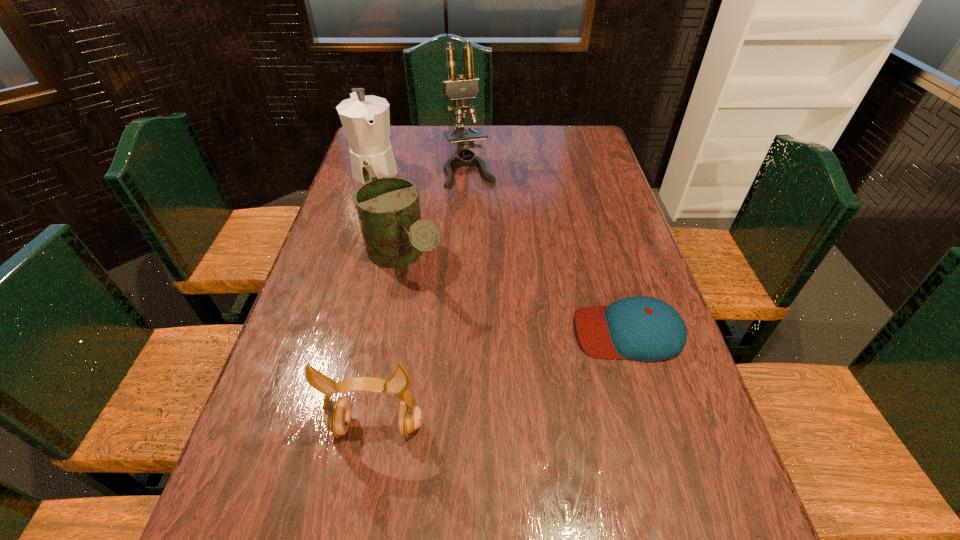
Locate an element on the screen. free area in between the microscope and the coffeepot is located at coordinates (422, 170).

Locate an element on the screen. This screenshot has height=540, width=960. free space between the coffeepot and the tallest object is located at coordinates (422, 170).

The height and width of the screenshot is (540, 960). I want to click on vacant area between the rightmost object and the microscope, so pyautogui.click(x=549, y=251).

Where is `free space between the watering can and the earphone`? The image size is (960, 540). free space between the watering can and the earphone is located at coordinates (391, 342).

You are a GUI agent. You are given a task and a screenshot of the screen. Output one action in this format:
    pyautogui.click(x=<x>, y=<y>)
    Task: Click on the free area in between the nearest object and the tallest object
    The height and width of the screenshot is (540, 960).
    Given the screenshot: What is the action you would take?
    [423, 299]

Find the location of a particular element. free space between the tallest object and the rightmost object is located at coordinates (549, 251).

Identify the location of free space between the microscope and the rightmost object. (549, 251).

Identify the location of free space between the second tallest object and the nearest object. The image size is (960, 540). (376, 298).

Locate an element on the screen. This screenshot has height=540, width=960. object that stands as the second closest to the second tallest object is located at coordinates (388, 208).

Where is `the closest object relative to the tallest object`? The width and height of the screenshot is (960, 540). the closest object relative to the tallest object is located at coordinates (366, 119).